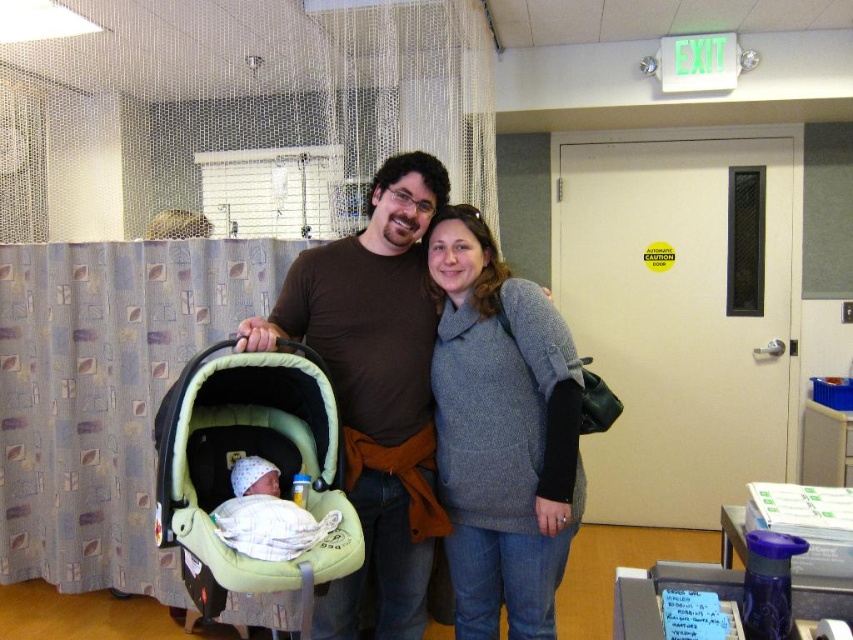
Who is more distant from viewer, (492, 593) or (245, 536)?

Point (492, 593)

Does point (535, 289) come behind point (311, 515)?

Yes, point (535, 289) is farther from viewer.

This screenshot has height=640, width=853. I want to click on gray wool sweater at center, so click(502, 433).

From the picture: Does gray wool sweater at center appear on the left side of green fabric baby carriage at center?

No, gray wool sweater at center is not to the left of green fabric baby carriage at center.

I want to click on gray wool sweater at center, so click(x=502, y=433).

Between point (328, 316) and point (257, 506), which one is positioned behind?

The point (328, 316) is more distant.

Is point (347, 273) farther from camera compared to point (230, 477)?

Yes, it is.

Describe the element at coordinates (376, 388) in the screenshot. I see `matte brown shirt at center` at that location.

Where is `matte brown shirt at center`? The image size is (853, 640). matte brown shirt at center is located at coordinates (376, 388).